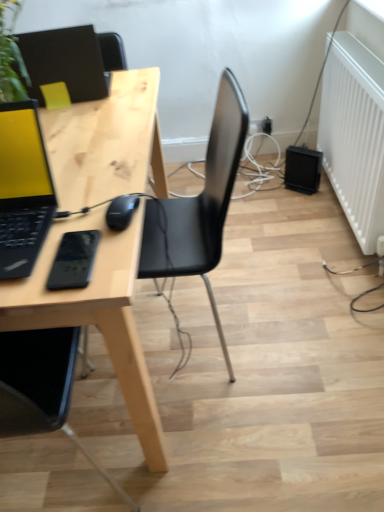
Question: Is white matte radiator at right taller or shorter than black matte mouse at center?

Choices:
 (A) short
 (B) tall

Answer: (B)

Question: From the image's perspective, is white matte radiator at right positioned above or below black matte mouse at center?

Choices:
 (A) above
 (B) below

Answer: (A)

Question: Considering the real-world distances, which object is closest to the matte black laptop at left, placed as the first laptop when sorted from bottom to top?

Choices:
 (A) matte black laptop at upper left, arranged as the 1th laptop when viewed from the back
 (B) white matte radiator at right
 (C) black matte mouse at center
 (D) black plastic speaker at lower right
 (E) light wood desk at center

Answer: (E)

Question: Estimate the real-world distances between objects in this image. Which object is closer to the white matte radiator at right?

Choices:
 (A) black plastic electric outlet at lower right
 (B) black matte mouse at center
 (C) matte black laptop at upper left, arranged as the 1th laptop when viewed from the back
 (D) light wood desk at center
 (E) matte black laptop at left, acting as the 2th laptop starting from the back

Answer: (A)